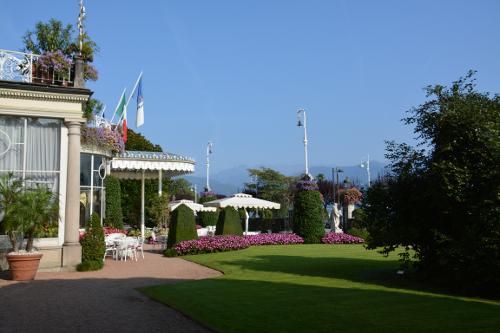
Image resolution: width=500 pixels, height=333 pixels. Find the location of `table and seating`. table and seating is located at coordinates (118, 248).